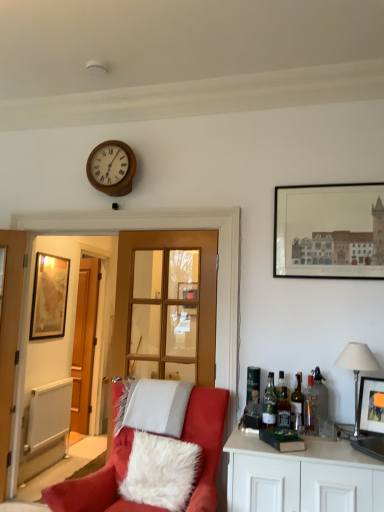
Find the location of `free space above matte paper picture frame at upper right, arranged as the 2th picture frame when viewed from the back (from a real-world perspective)`. free space above matte paper picture frame at upper right, arranged as the 2th picture frame when viewed from the back (from a real-world perspective) is located at coordinates (329, 184).